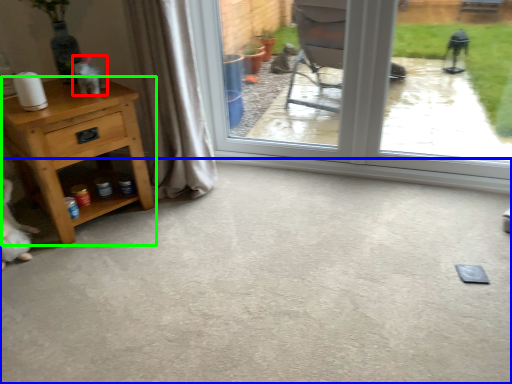
Question: Estimate the real-world distances between objects in this image. Which object is closer to animal (highlighted by a red box), concrete (highlighted by a blue box) or nightstand (highlighted by a green box)?

Choices:
 (A) concrete
 (B) nightstand

Answer: (B)